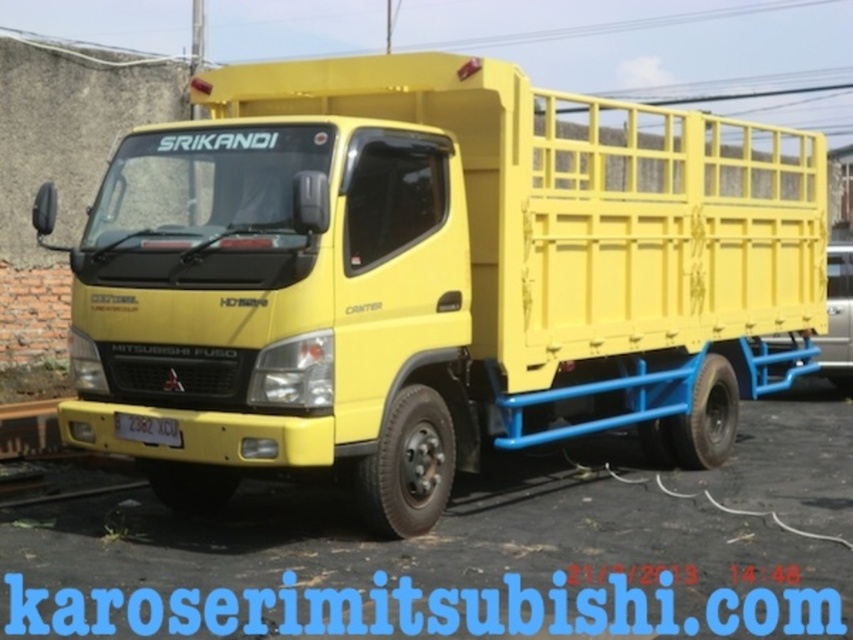
Question: Considering the relative positions of matte yellow truck at center and yellow metal train track at lower left in the image provided, where is matte yellow truck at center located with respect to yellow metal train track at lower left?

Choices:
 (A) below
 (B) above

Answer: (B)

Question: Which object appears farthest from the camera in this image?

Choices:
 (A) black plastic license plate at center
 (B) yellow metal train track at lower left
 (C) matte yellow truck at center

Answer: (C)

Question: Among these objects, which one is nearest to the camera?

Choices:
 (A) yellow metal train track at lower left
 (B) matte yellow truck at center
 (C) black plastic license plate at center

Answer: (C)

Question: From the image, what is the correct spatial relationship of matte yellow truck at center in relation to yellow metal train track at lower left?

Choices:
 (A) left
 (B) right

Answer: (B)

Question: Based on their relative distances, which object is farther from the matte yellow truck at center?

Choices:
 (A) yellow metal train track at lower left
 (B) black plastic license plate at center

Answer: (A)

Question: Can you confirm if matte yellow truck at center is thinner than yellow metal train track at lower left?

Choices:
 (A) yes
 (B) no

Answer: (A)